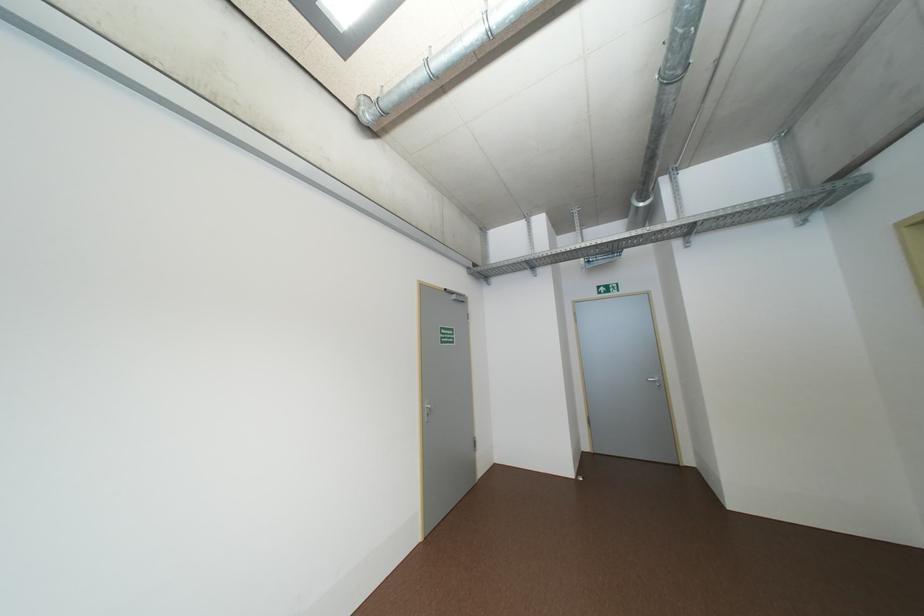
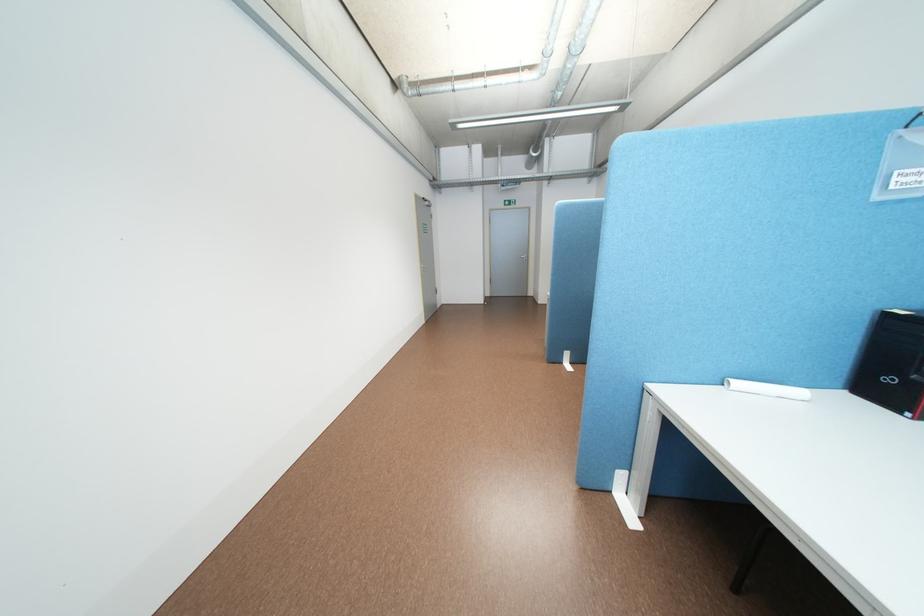
In the second image, find the point that corresponds to (x=598, y=447) in the first image.

(499, 294)